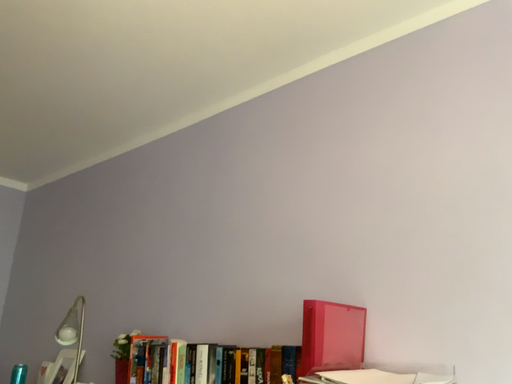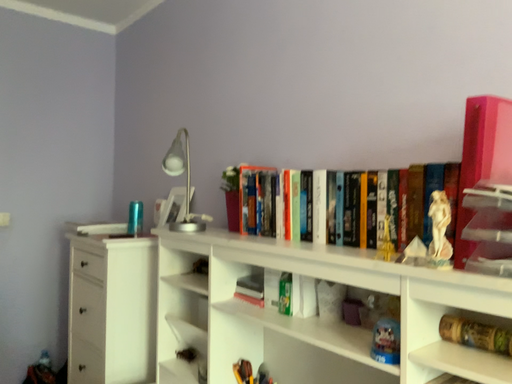
Question: Which way did the camera rotate in the video?

Choices:
 (A) rotated right
 (B) rotated left

Answer: (B)